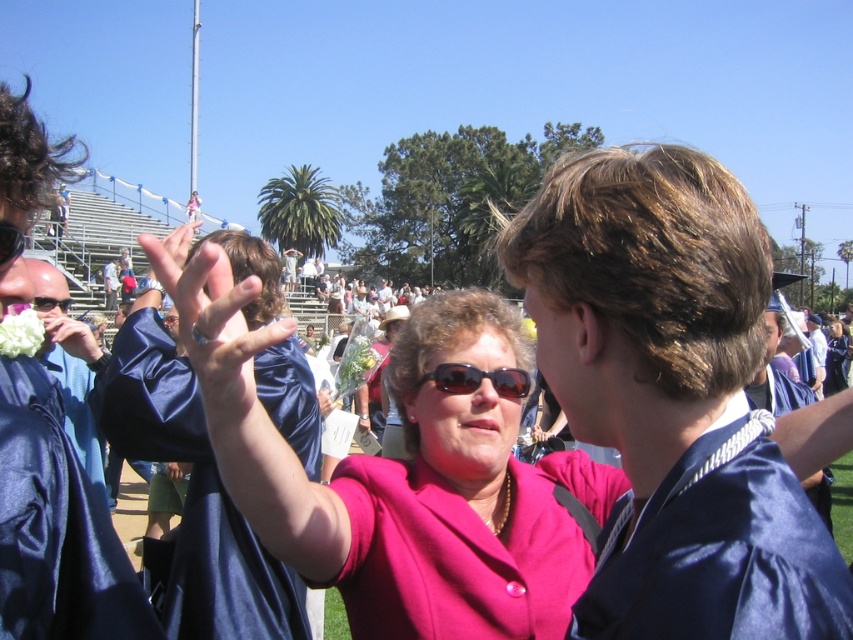
Question: Which object is positioned closest to the pink satin jacket at center?

Choices:
 (A) black plastic sunglasses at center
 (B) white fluffy flower at center

Answer: (A)

Question: Does pink satin jacket at center appear on the left side of black plastic sunglasses at center?

Choices:
 (A) no
 (B) yes

Answer: (B)

Question: Which of the following is the closest to the observer?

Choices:
 (A) (201, 340)
 (B) (502, 378)

Answer: (A)

Question: Is pink satin jacket at center below white fluffy flower at center?

Choices:
 (A) yes
 (B) no

Answer: (A)

Question: Does pink satin jacket at center lie in front of black plastic sunglasses at center?

Choices:
 (A) no
 (B) yes

Answer: (B)

Question: Which of the following is the closest to the observer?

Choices:
 (A) black plastic sunglasses at center
 (B) pink satin jacket at center
 (C) white fluffy flower at center

Answer: (B)